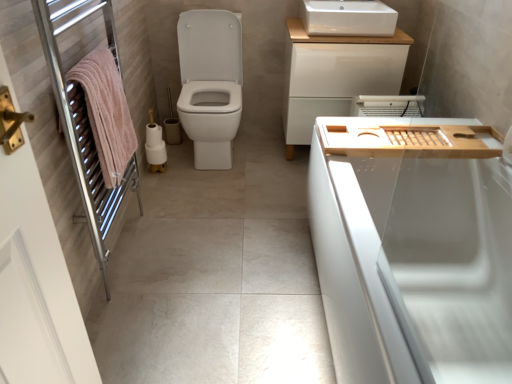
Locate an element on the screen. Image resolution: width=512 pixels, height=384 pixels. vacant space to the right of white glossy toilet at center is located at coordinates (263, 162).